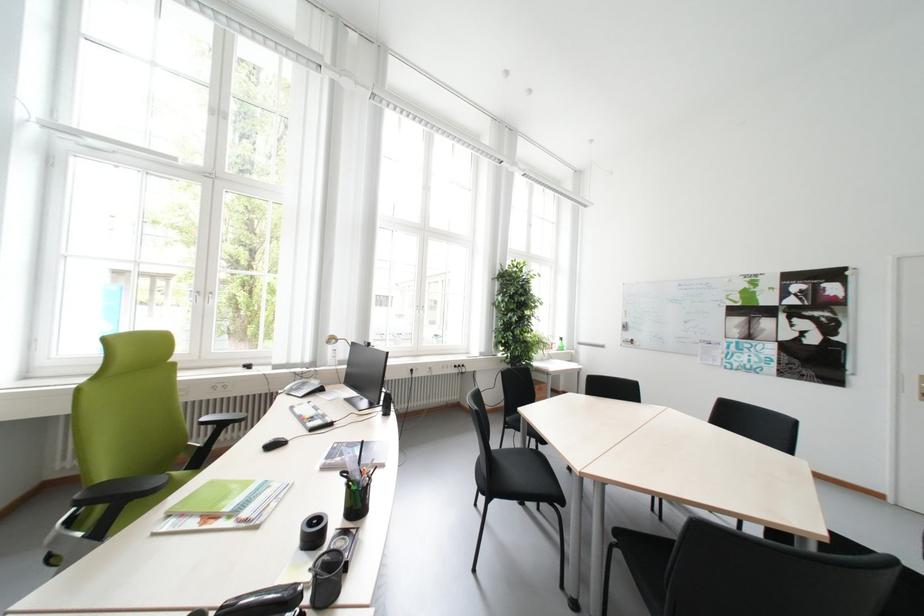
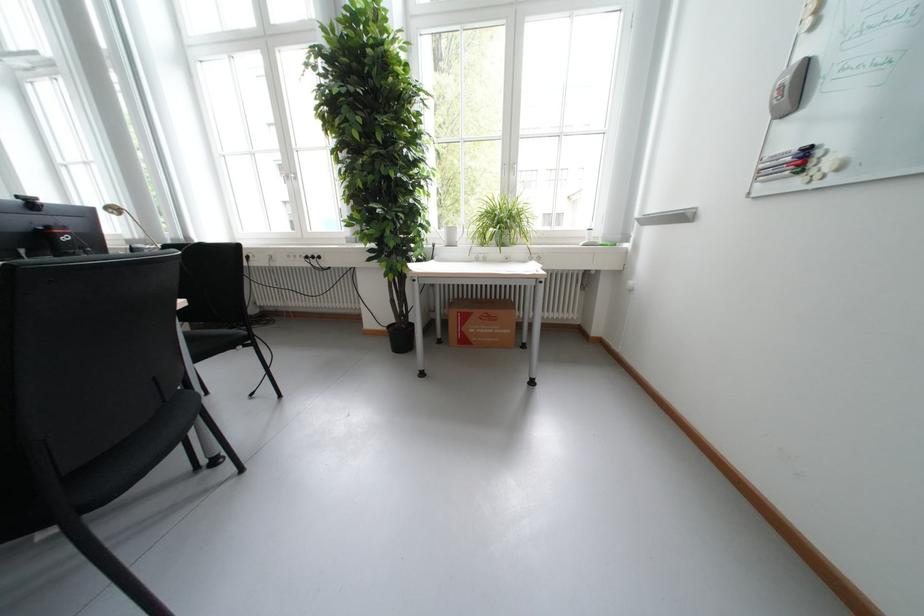
The point at [641,347] is marked in the first image. Where is the corresponding point in the second image?

(806, 184)